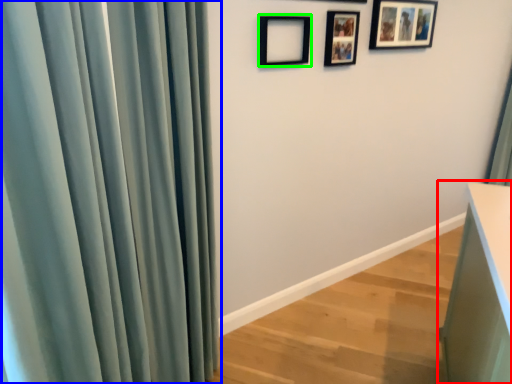
Question: Which is nearer to the vanity (highlighted by a red box)? curtain (highlighted by a blue box) or picture frame (highlighted by a green box).

Choices:
 (A) curtain
 (B) picture frame

Answer: (A)